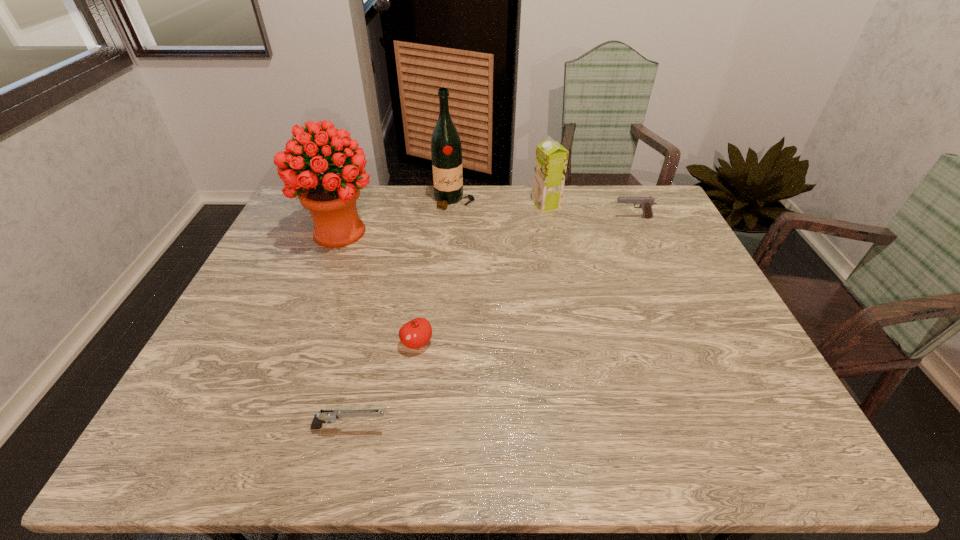
You are a GUI agent. You are given a task and a screenshot of the screen. Output one action in this format:
    pyautogui.click(x=<x>, y=<y>)
    Task: Click on the free spot between the bouquet and the second object from right to left
    Image resolution: width=960 pixels, height=540 pixels.
    Given the screenshot: What is the action you would take?
    pyautogui.click(x=443, y=218)

This screenshot has width=960, height=540. I want to click on empty space between the apple and the wine bottle, so click(x=436, y=272).

This screenshot has width=960, height=540. Find the location of `free area in between the fifth object from left to right and the wine bottle`. free area in between the fifth object from left to right and the wine bottle is located at coordinates 500,202.

I want to click on vacant space that's between the bouquet and the apple, so click(x=378, y=288).

At what (x,y) coordinates should I click in order to perform the action: click on free space that is in between the apple and the left pistol. Please return your answer as a coordinate pair (x, y). The image size is (960, 540). Looking at the image, I should click on 383,386.

Where is `vacant space that's between the shorter pistol and the bouquet`? The image size is (960, 540). vacant space that's between the shorter pistol and the bouquet is located at coordinates (345, 330).

This screenshot has height=540, width=960. Identify the location of unoccupied position between the shortest object and the wine bottle. (402, 314).

You are a GUI agent. You are given a task and a screenshot of the screen. Output one action in this format:
    pyautogui.click(x=<x>, y=<y>)
    Task: Click on the empty location between the shortest object and the bouquet
    
    Given the screenshot: What is the action you would take?
    pyautogui.click(x=345, y=330)

Locate an element on the screen. Image resolution: width=960 pixels, height=540 pixels. object identified as the fourth closest to the farther pistol is located at coordinates (331, 197).

Identify which object is the second closest to the wine bottle. Please provide its 2D coordinates. Your answer should be formatted as a tuple, i.e. [(x, y)], where the tuple contains the x and y coordinates of a point satisfying the conditions above.

[(551, 159)]